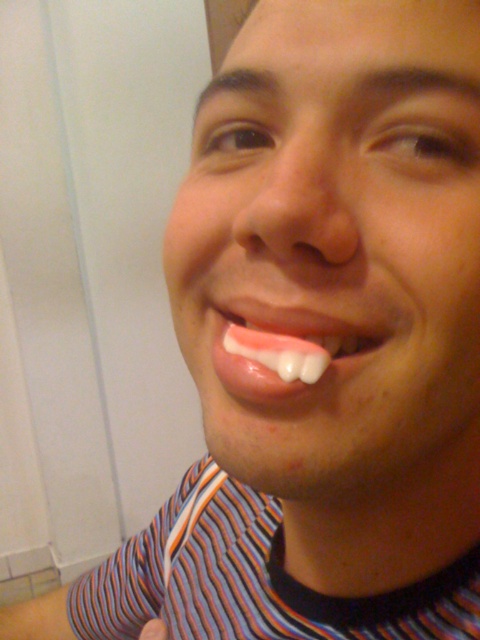
You are a fashion designer analyzing the image. You need to determine if the striped fabric shirt at lower center can be paired with a necklace that has a pendant as wide as the pink glossy tongue at center. Can the pendant fit within the shirt?

The striped fabric shirt at lower center has a width larger than the pink glossy tongue at center, so the pendant with a width equal to the pink glossy tongue at center can fit within the shirt.

Looking at this image, you are a dental professional examining a patient. You notice the striped fabric shirt at lower center and the pink glossy tongue at center. Which object is positioned to the right side of the other?

The pink glossy tongue at center is positioned to the right of the striped fabric shirt at lower center because the striped fabric shirt at lower center is to the left of pink glossy tongue at center.

You are a dental professional assessing a patient. You notice the striped fabric shirt at lower center and the pink glossy tongue at center. Which object is positioned higher in the image?

The striped fabric shirt at lower center is much taller than the pink glossy tongue at center, so the striped fabric shirt at lower center is positioned higher in the image.